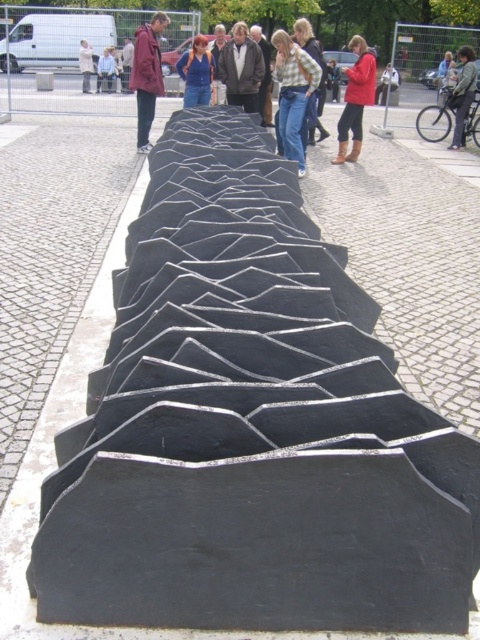
Question: Is brown leather jacket at center positioned at the back of matte black sculpture at center?

Choices:
 (A) yes
 (B) no

Answer: (B)

Question: Which is farther from the light blue jeans at center?

Choices:
 (A) brown leather jacket at center
 (B) matte black bike at right

Answer: (B)

Question: Which of the following is the closest to the observer?

Choices:
 (A) matte black bike at right
 (B) denim jacket at upper center
 (C) matte black jacket at center

Answer: (C)

Question: Is plaid shirt at center thinner than matte black sculpture at center?

Choices:
 (A) no
 (B) yes

Answer: (A)

Question: Which point appears closest to the camera in this image?

Choices:
 (A) (106, 84)
 (B) (269, 58)

Answer: (B)

Question: Does matte black bike at right appear on the left side of matte black sculpture at center?

Choices:
 (A) yes
 (B) no

Answer: (B)